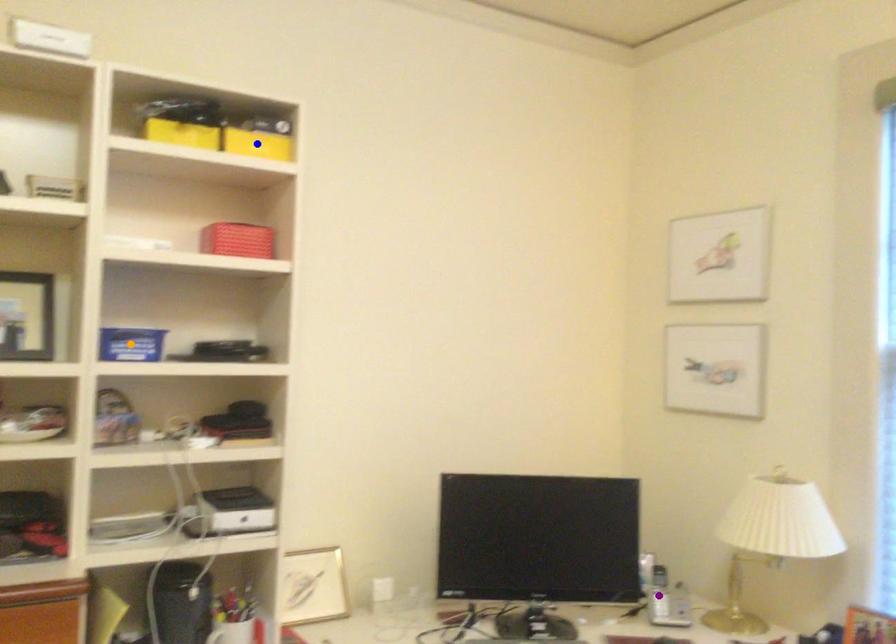
Order these from farthest to nearest:
- purple point
- orange point
- blue point

purple point, blue point, orange point